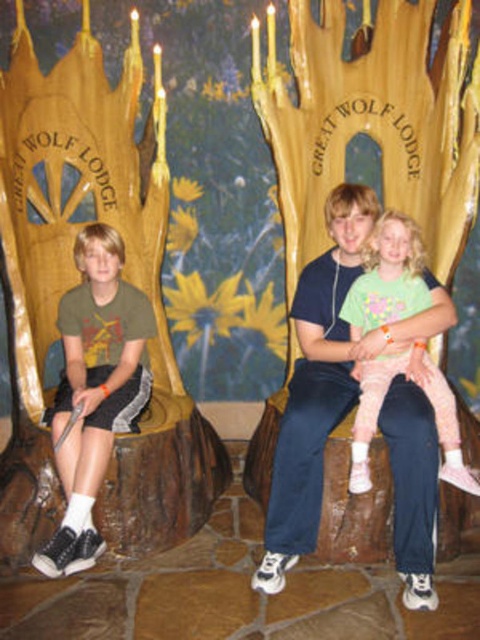
You are a photographer setting up for a group photo at the Great Wolf Lodge event. You notice two items of clothing worn by the participants in the center of the scene. The light green cotton shirt at center and the pink fabric pants at center. Which clothing item appears bigger in the photo?

The light green cotton shirt at center appears bigger in the photo because it has a larger size compared to the pink fabric pants at center.

You are standing in front of the backdrop of the Great Wolf Lodge. You see a light green cotton shirt at center and a pink fabric pants at center. Which clothing item is nearer to you?

The light green cotton shirt at center is closer to the viewer than the pink fabric pants at center.